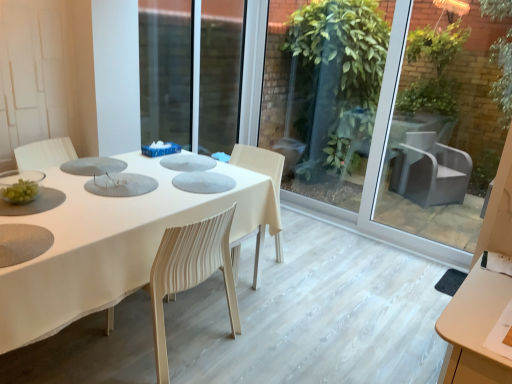
Question: Is transparent glass door at center behind white fabric table at center?

Choices:
 (A) yes
 (B) no

Answer: (A)

Question: Can you confirm if transparent glass door at center is taller than white fabric table at center?

Choices:
 (A) yes
 (B) no

Answer: (A)

Question: Considering the relative sizes of transparent glass door at center and white fabric table at center in the image provided, is transparent glass door at center thinner than white fabric table at center?

Choices:
 (A) no
 (B) yes

Answer: (B)

Question: From a real-world perspective, is transparent glass door at center over white fabric table at center?

Choices:
 (A) yes
 (B) no

Answer: (A)

Question: Considering the relative positions of transparent glass door at center and white fabric table at center in the image provided, is transparent glass door at center to the left of white fabric table at center from the viewer's perspective?

Choices:
 (A) yes
 (B) no

Answer: (B)

Question: Looking at the image, does white striped fabric chair at center seem bigger or smaller compared to white fabric table at center?

Choices:
 (A) small
 (B) big

Answer: (A)

Question: Looking at their shapes, would you say white striped fabric chair at center is wider or thinner than white fabric table at center?

Choices:
 (A) wide
 (B) thin

Answer: (B)

Question: Is white striped fabric chair at center taller or shorter than white fabric table at center?

Choices:
 (A) short
 (B) tall

Answer: (B)

Question: Is white striped fabric chair at center in front of or behind white fabric table at center in the image?

Choices:
 (A) behind
 (B) front

Answer: (A)

Question: From a real-world perspective, relative to transparent glass door at center, is white fabric table at center vertically above or below?

Choices:
 (A) below
 (B) above

Answer: (A)

Question: Is point (51, 274) closer or farther from the camera than point (310, 104)?

Choices:
 (A) farther
 (B) closer

Answer: (B)

Question: Considering their positions, is white fabric table at center located in front of or behind transparent glass door at center?

Choices:
 (A) behind
 (B) front

Answer: (B)

Question: Which is correct: white fabric table at center is inside transparent glass door at center, or outside of it?

Choices:
 (A) outside
 (B) inside

Answer: (A)

Question: Looking at their shapes, would you say white fabric table at center is wider or thinner than white striped fabric chair at center?

Choices:
 (A) thin
 (B) wide

Answer: (B)

Question: Considering the positions of point (90, 284) and point (154, 271), is point (90, 284) closer or farther from the camera than point (154, 271)?

Choices:
 (A) closer
 (B) farther

Answer: (A)